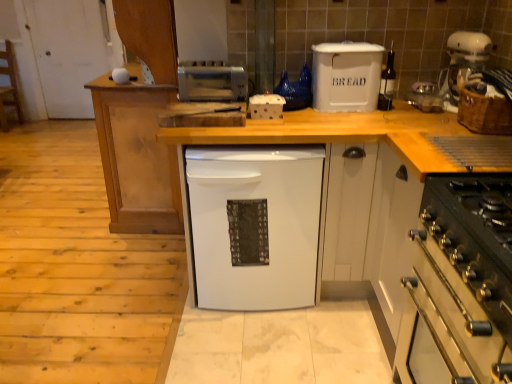
Locate an element on the screen. black metallic oven at lower right is located at coordinates (459, 284).

Measure the distance between point [274,112] and camera.

A distance of 1.97 meters exists between point [274,112] and camera.

What do you see at coordinates (266, 106) in the screenshot? I see `white plastic container at center, positioned as the 3th appliance in right-to-left order` at bounding box center [266, 106].

What do you see at coordinates (387, 82) in the screenshot? The image size is (512, 384). I see `matte white wine bottle at center, the second appliance when ordered from right to left` at bounding box center [387, 82].

What do you see at coordinates (462, 63) in the screenshot?
I see `white plastic coffee machine at upper right` at bounding box center [462, 63].

This screenshot has width=512, height=384. What are the coordinates of `wooden ladder at left` in the screenshot? It's located at coord(9,86).

Would you say clear plastic container at upper right, the 4th appliance viewed from the left, contains white plastic coffee machine at upper right?

No, clear plastic container at upper right, the 4th appliance viewed from the left, does not contain white plastic coffee machine at upper right.

From a real-world perspective, does clear plastic container at upper right, the 4th appliance viewed from the left, stand above white plastic coffee machine at upper right?

No, from a real-world perspective, clear plastic container at upper right, the 4th appliance viewed from the left, is not above white plastic coffee machine at upper right.

Based on the photo, is clear plastic container at upper right, the 4th appliance viewed from the left, to the right of white plastic coffee machine at upper right from the viewer's perspective?

In fact, clear plastic container at upper right, the 4th appliance viewed from the left, is to the left of white plastic coffee machine at upper right.

In terms of height, does clear plastic container at upper right, which is the first appliance in right-to-left order, look taller or shorter compared to white plastic coffee machine at upper right?

clear plastic container at upper right, which is the first appliance in right-to-left order, is shorter than white plastic coffee machine at upper right.

From a real-world perspective, is wooden ladder at left beneath white matte dishwasher at center?

No, from a real-world perspective, wooden ladder at left is not below white matte dishwasher at center.

Which is in front, point (6, 58) or point (303, 158)?

The point (303, 158) is more forward.

Can you confirm if wooden ladder at left is thinner than white matte dishwasher at center?

Indeed, wooden ladder at left has a lesser width compared to white matte dishwasher at center.

Based on the photo, from a real-world perspective, does white wood countertop at center sit lower than wooden ladder at left?

Yes.

Is white wood countertop at center not within wooden ladder at left?

That's correct, white wood countertop at center is outside of wooden ladder at left.

Which object is closer to the camera taking this photo, white wood countertop at center or wooden ladder at left?

white wood countertop at center is more forward.

Is white wood countertop at center looking in the opposite direction of wooden ladder at left?

No, white wood countertop at center is not facing away from wooden ladder at left.

From the image's perspective, between wooden ladder at left and matte white wine bottle at center, the second appliance when ordered from right to left, who is located below?

matte white wine bottle at center, the second appliance when ordered from right to left.

From a real-world perspective, which is physically below, wooden ladder at left or matte white wine bottle at center, the second appliance when ordered from right to left?

From a 3D spatial view, wooden ladder at left is below.

Does wooden ladder at left have a greater width compared to matte white wine bottle at center, acting as the 3th appliance starting from the left?

Yes, wooden ladder at left is wider than matte white wine bottle at center, acting as the 3th appliance starting from the left.

Is wooden ladder at left looking in the opposite direction of matte white wine bottle at center, acting as the 3th appliance starting from the left?

No.

Who is smaller, white plastic bread bin at upper center or clear plastic container at upper right, the 4th appliance viewed from the left?

With smaller size is clear plastic container at upper right, the 4th appliance viewed from the left.

Between white plastic bread bin at upper center and clear plastic container at upper right, which is the first appliance in right-to-left order, which one appears on the right side from the viewer's perspective?

Positioned to the right is clear plastic container at upper right, which is the first appliance in right-to-left order.

From the image's perspective, which object appears higher, white plastic bread bin at upper center or clear plastic container at upper right, which is the first appliance in right-to-left order?

white plastic bread bin at upper center appears higher in the image.

Can you confirm if white plastic bread bin at upper center is positioned to the right of black metallic oven at lower right?

No.

Find the location of a particular element. The image size is (512, 384). kitchen appliance behind the black metallic oven at lower right is located at coordinates (346, 76).

Based on the photo, can you confirm if white plastic bread bin at upper center is wider than black metallic oven at lower right?

Incorrect, the width of white plastic bread bin at upper center does not surpass that of black metallic oven at lower right.

From a real-world perspective, is white plastic bread bin at upper center below black metallic oven at lower right?

No, from a real-world perspective, white plastic bread bin at upper center is not beneath black metallic oven at lower right.

Does point (475, 40) lie behind point (318, 131)?

Yes, it is.

Does white plastic coffee machine at upper right have a lesser width compared to white wood countertop at center?

Indeed, white plastic coffee machine at upper right has a lesser width compared to white wood countertop at center.

Is white plastic coffee machine at upper right directly adjacent to white wood countertop at center?

No, white plastic coffee machine at upper right is not touching white wood countertop at center.

How much distance is there between white plastic coffee machine at upper right and white wood countertop at center?

white plastic coffee machine at upper right is 19.73 inches away from white wood countertop at center.

At what (x,y) coordinates should I click in order to perform the action: click on coffee machine above the clear plastic container at upper right, which is the first appliance in right-to-left order (from a real-world perspective). Please return your answer as a coordinate pair (x, y). Looking at the image, I should click on (462, 63).

The height and width of the screenshot is (384, 512). I want to click on dish washer below the wooden ladder at left (from the image's perspective), so click(x=254, y=225).

Looking at the image, which one is located further to white plastic coffee machine at upper right, woven brown basket at right or clear plastic container at upper right, the 4th appliance viewed from the left?

Among the two, woven brown basket at right is located further to white plastic coffee machine at upper right.

Estimate the real-world distances between objects in this image. Which object is closer to white matte dishwasher at center, matte white wine bottle at center, acting as the 3th appliance starting from the left, or white plastic coffee machine at upper right?

matte white wine bottle at center, acting as the 3th appliance starting from the left, is positioned closer to the anchor white matte dishwasher at center.

When comparing their distances from matte white wine bottle at center, the second appliance when ordered from right to left, does white plastic bread bin at upper center or white matte dishwasher at center seem further?

white matte dishwasher at center is positioned further to the anchor matte white wine bottle at center, the second appliance when ordered from right to left.

Looking at the image, which one is located closer to white wood countertop at center, satin silver toaster at upper center, which is counted as the fourth appliance, starting from the right, or black metallic oven at lower right?

black metallic oven at lower right lies closer to white wood countertop at center than the other object.

Consider the image. When comparing their distances from matte white wine bottle at center, acting as the 3th appliance starting from the left, does white wood countertop at center or woven brown basket at right seem closer?

The object closer to matte white wine bottle at center, acting as the 3th appliance starting from the left, is white wood countertop at center.

From the image, which object appears to be farther from white matte dishwasher at center, matte white wine bottle at center, acting as the 3th appliance starting from the left, or clear plastic container at upper right, the 4th appliance viewed from the left?

clear plastic container at upper right, the 4th appliance viewed from the left, is positioned further to the anchor white matte dishwasher at center.

Considering their positions, is white plastic bread bin at upper center positioned closer to matte white wine bottle at center, acting as the 3th appliance starting from the left, than white plastic container at center, positioned as the 3th appliance in right-to-left order?

Among the two, white plastic bread bin at upper center is located nearer to matte white wine bottle at center, acting as the 3th appliance starting from the left.

Consider the image. Estimate the real-world distances between objects in this image. Which object is further from black metallic oven at lower right, white plastic bread bin at upper center or satin silver toaster at upper center, which is counted as the fourth appliance, starting from the right?

The object further to black metallic oven at lower right is satin silver toaster at upper center, which is counted as the fourth appliance, starting from the right.

Where is `basket between matte white wine bottle at center, acting as the 3th appliance starting from the left, and black metallic oven at lower right from top to bottom`? basket between matte white wine bottle at center, acting as the 3th appliance starting from the left, and black metallic oven at lower right from top to bottom is located at coordinates (483, 112).

This screenshot has width=512, height=384. I want to click on countertop located between wooden ladder at left and matte white wine bottle at center, acting as the 3th appliance starting from the left, in the left-right direction, so click(335, 142).

You are a GUI agent. You are given a task and a screenshot of the screen. Output one action in this format:
    pyautogui.click(x=<x>, y=<y>)
    Task: Click on the countertop located between white matte dishwasher at center and woven brown basket at right in the left-right direction
    This screenshot has width=512, height=384.
    Given the screenshot: What is the action you would take?
    pyautogui.click(x=335, y=142)

Where is `appliance between wooden ladder at left and white matte dishwasher at center from left to right`? The width and height of the screenshot is (512, 384). appliance between wooden ladder at left and white matte dishwasher at center from left to right is located at coordinates (212, 81).